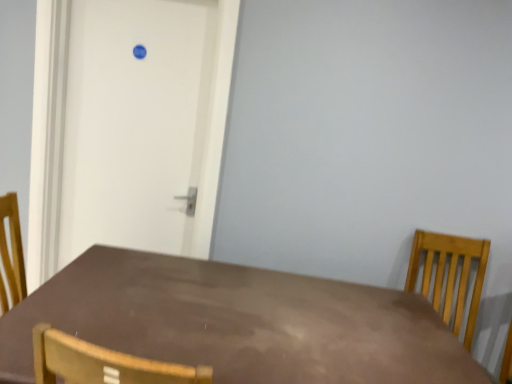
Question: Does white matte door at upper left have a larger size compared to brown matte table at center?

Choices:
 (A) yes
 (B) no

Answer: (B)

Question: Can you confirm if white matte door at upper left is wider than brown matte table at center?

Choices:
 (A) yes
 (B) no

Answer: (B)

Question: Can you confirm if white matte door at upper left is positioned to the right of brown matte table at center?

Choices:
 (A) yes
 (B) no

Answer: (B)

Question: Is the depth of white matte door at upper left less than that of brown matte table at center?

Choices:
 (A) yes
 (B) no

Answer: (B)

Question: Can you confirm if white matte door at upper left is positioned to the left of brown matte table at center?

Choices:
 (A) no
 (B) yes

Answer: (B)

Question: Is white matte door at upper left looking in the opposite direction of brown matte table at center?

Choices:
 (A) no
 (B) yes

Answer: (A)

Question: Is there a large distance between white matte door at upper left and light brown wooden chair at right?

Choices:
 (A) yes
 (B) no

Answer: (A)

Question: Are white matte door at upper left and light brown wooden chair at right making contact?

Choices:
 (A) no
 (B) yes

Answer: (A)

Question: From the image's perspective, is white matte door at upper left over light brown wooden chair at right?

Choices:
 (A) no
 (B) yes

Answer: (B)

Question: Does white matte door at upper left have a larger size compared to light brown wooden chair at right?

Choices:
 (A) no
 (B) yes

Answer: (A)

Question: Would you say white matte door at upper left contains light brown wooden chair at right?

Choices:
 (A) no
 (B) yes

Answer: (A)

Question: Considering the relative sizes of white matte door at upper left and light brown wooden chair at right in the image provided, is white matte door at upper left thinner than light brown wooden chair at right?

Choices:
 (A) no
 (B) yes

Answer: (B)

Question: Does light brown wooden chair at right come in front of brown matte table at center?

Choices:
 (A) yes
 (B) no

Answer: (B)